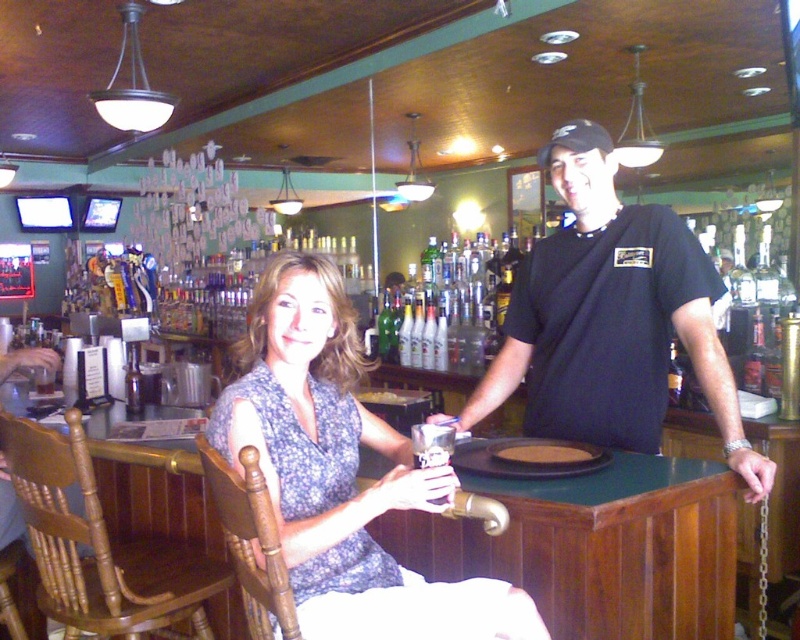
Question: Which object is closer to the camera taking this photo?

Choices:
 (A) floral fabric dress at center
 (B) black matte t-shirt at center

Answer: (A)

Question: Which point appears farthest from the camera in this image?

Choices:
 (A) click(288, 456)
 (B) click(632, 369)

Answer: (B)

Question: Does floral fabric dress at center have a larger size compared to black matte t-shirt at center?

Choices:
 (A) no
 (B) yes

Answer: (A)

Question: Does floral fabric dress at center have a larger size compared to black matte t-shirt at center?

Choices:
 (A) yes
 (B) no

Answer: (B)

Question: Where is floral fabric dress at center located in relation to black matte t-shirt at center in the image?

Choices:
 (A) right
 (B) left

Answer: (B)

Question: Among these objects, which one is farthest from the camera?

Choices:
 (A) floral fabric dress at center
 (B) black matte t-shirt at center

Answer: (B)